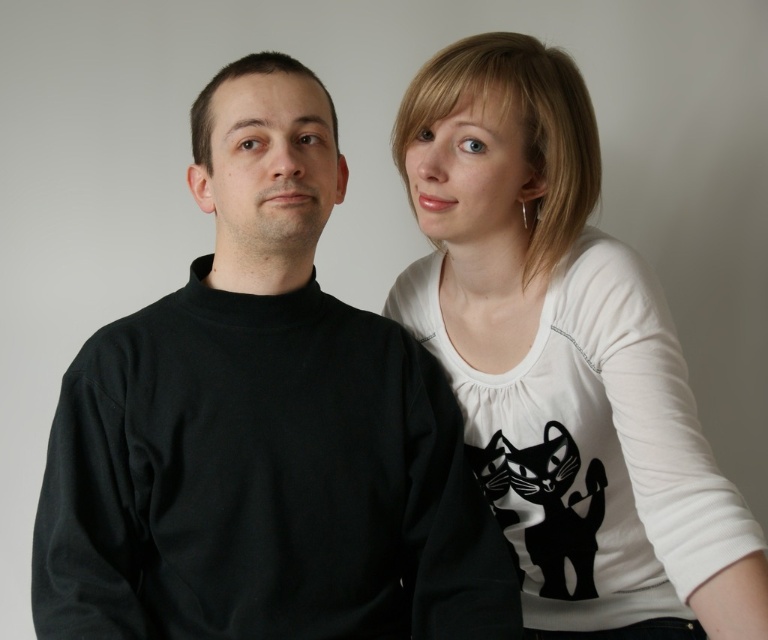
Question: In this image, where is black matte turtleneck sweater at left located relative to white matte shirt at upper right?

Choices:
 (A) above
 (B) below

Answer: (A)

Question: From the image, what is the correct spatial relationship of black matte turtleneck sweater at left in relation to white matte shirt at upper right?

Choices:
 (A) right
 (B) left

Answer: (B)

Question: Which object appears closest to the camera in this image?

Choices:
 (A) white matte shirt at upper right
 (B) black matte turtleneck sweater at left

Answer: (A)

Question: Considering the relative positions of black matte turtleneck sweater at left and white matte shirt at upper right in the image provided, where is black matte turtleneck sweater at left located with respect to white matte shirt at upper right?

Choices:
 (A) left
 (B) right

Answer: (A)

Question: Which object is farther from the camera taking this photo?

Choices:
 (A) white matte shirt at upper right
 (B) black matte turtleneck sweater at left

Answer: (B)